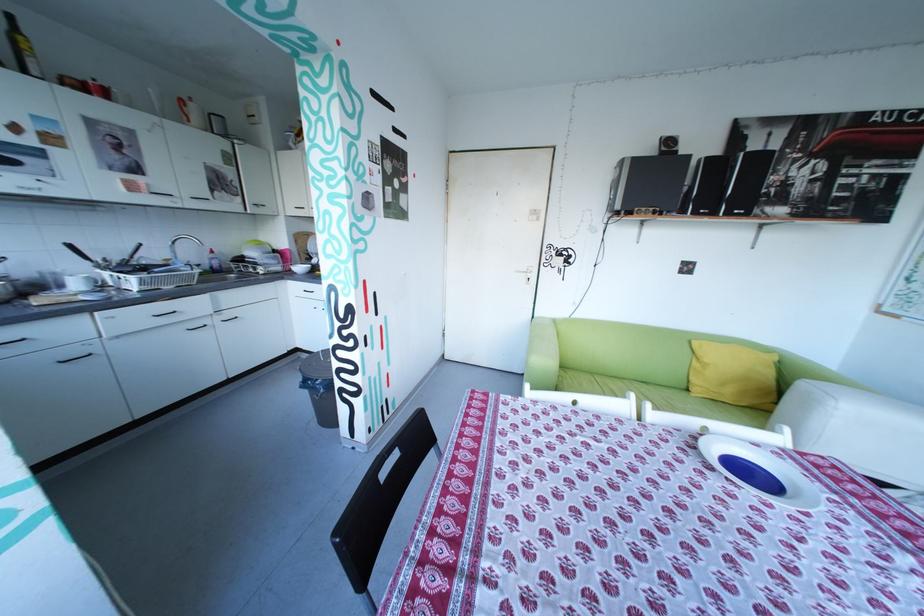
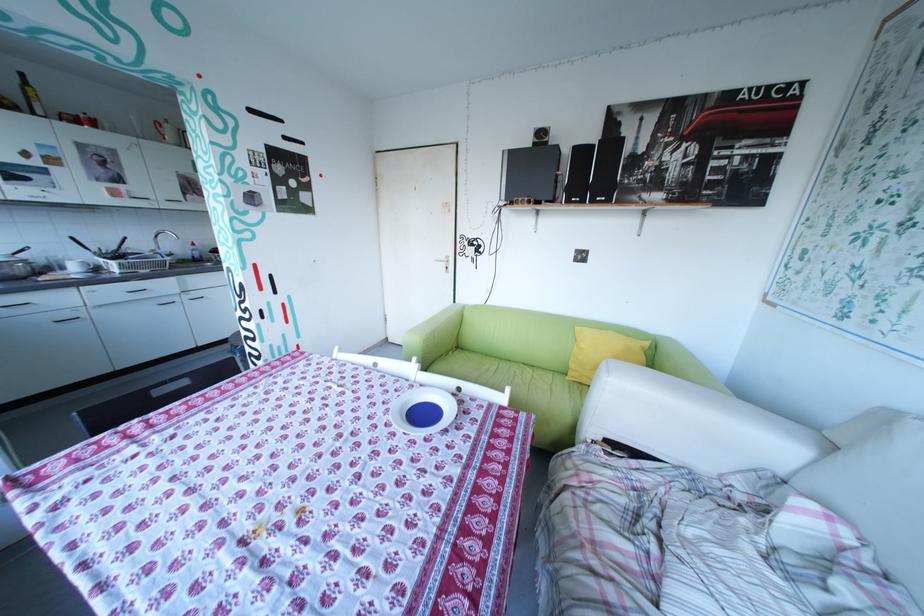
Question: What movement of the cameraman would produce the second image?

Choices:
 (A) Left
 (B) Right
 (C) Forward
 (D) Backward

Answer: (B)